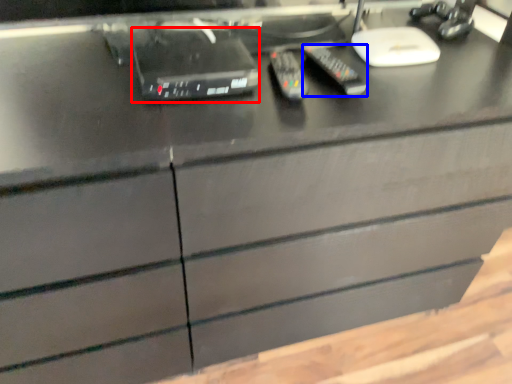
Question: Which object is further to the camera taking this photo, equipment (highlighted by a red box) or control (highlighted by a blue box)?

Choices:
 (A) equipment
 (B) control

Answer: (B)